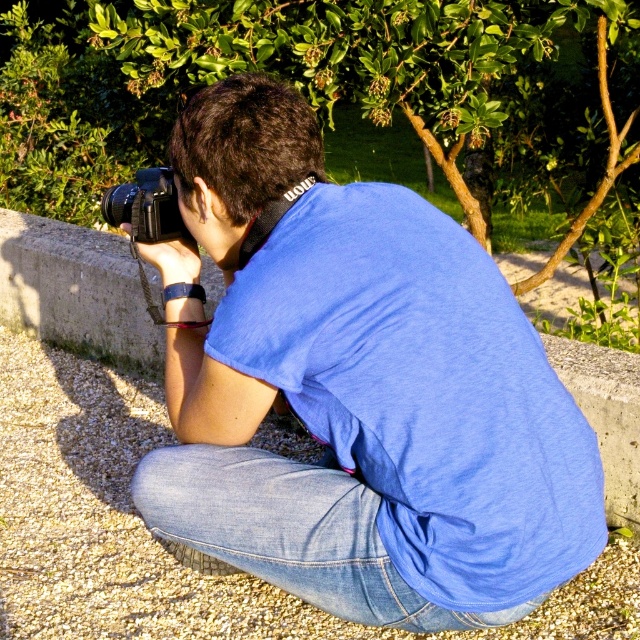
You are a photographer trying to adjust your camera settings to focus on both the blue cotton shirt at center and the denim at lower center simultaneously. Given that the depth of field can cover up to 5 inches, will both objects remain in focus?

The blue cotton shirt at center and denim at lower center are 4.98 inches apart. Since the depth of field can cover up to 5 inches, both objects will remain in focus.

You are a photographer trying to place a small 5cm wide accessory on the ground in the scene. You have two options to choose from the existing objects. Which object from the scene would allow the accessory to fit better in terms of width? Please choose between the gray gravel at lower left and the black plastic camera at center.

The gray gravel at lower left has a larger width than the black plastic camera at center, so placing the 5cm wide accessory on the gray gravel at lower left would provide better width compatibility.